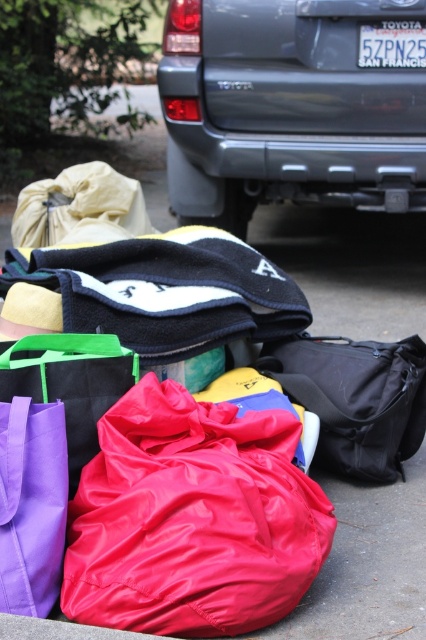
Which is below, shiny red sleeping bag at center or black matte duffel bag at center?

Positioned lower is shiny red sleeping bag at center.

Can you confirm if shiny red sleeping bag at center is shorter than black matte duffel bag at center?

Incorrect, shiny red sleeping bag at center's height does not fall short of black matte duffel bag at center's.

Does point (192, 556) come farther from viewer compared to point (382, 364)?

No, (192, 556) is in front of (382, 364).

Find the location of a particular element. shiny red sleeping bag at center is located at coordinates (192, 518).

Who is positioned more to the right, shiny red sleeping bag at center or rubberized fabric bags at center?

rubberized fabric bags at center

Looking at this image, is shiny red sleeping bag at center shorter than rubberized fabric bags at center?

Yes.

Describe the element at coordinates (192, 518) in the screenshot. I see `shiny red sleeping bag at center` at that location.

This screenshot has height=640, width=426. In order to click on shiny red sleeping bag at center in this screenshot , I will do `click(192, 518)`.

Is black matte duffel bag at center below 5zpn25 plastic at center?

Indeed, black matte duffel bag at center is positioned under 5zpn25 plastic at center.

Between black matte duffel bag at center and 5zpn25 plastic at center, which one has more height?

black matte duffel bag at center is taller.

Describe the element at coordinates (356, 397) in the screenshot. The image size is (426, 640). I see `black matte duffel bag at center` at that location.

This screenshot has height=640, width=426. I want to click on black matte duffel bag at center, so click(x=356, y=397).